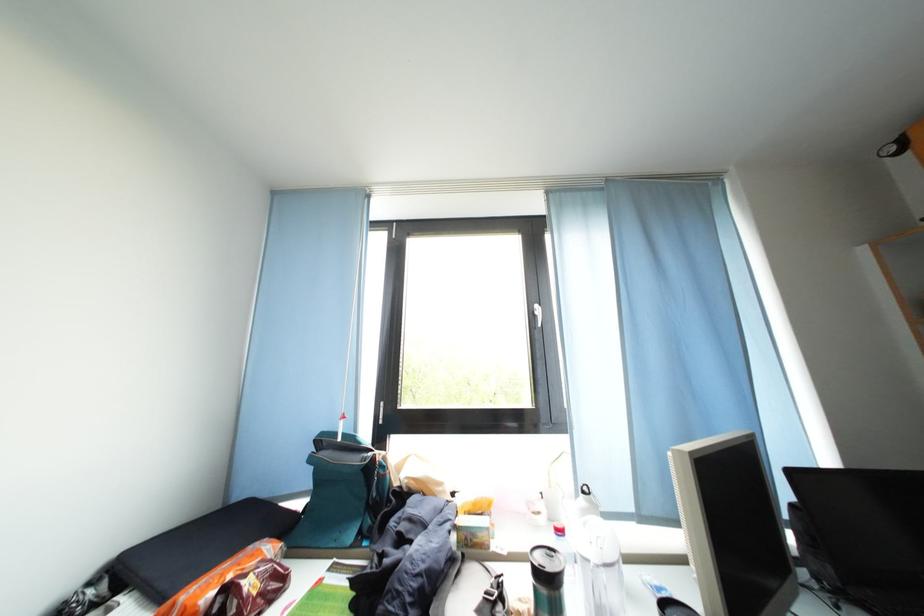
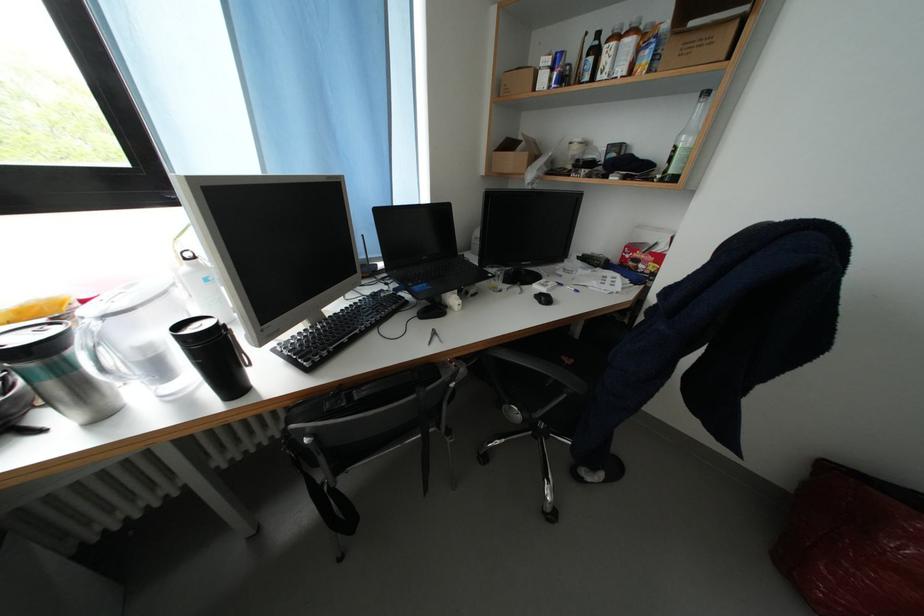
Based on the photo, the first image is from the beginning of the video and the second image is from the end. How did the camera likely rotate when shooting the video?

The camera's rotation is toward right-down.